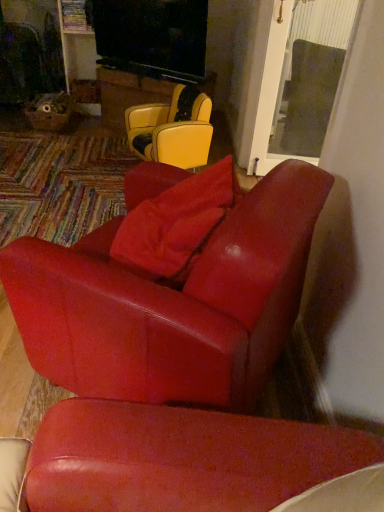
Question: Which direction should I rotate to look at matte red leather chair at center, which is the 2th chair from back to front, — up or down?

Choices:
 (A) up
 (B) down

Answer: (B)

Question: From the image's perspective, is leather yellow chair at center, arranged as the second chair when viewed from the front, beneath matte red leather chair at center, which is the 2th chair from back to front?

Choices:
 (A) no
 (B) yes

Answer: (A)

Question: From a real-world perspective, is leather yellow chair at center, the 2th chair positioned from the bottom, on matte red leather chair at center, which appears as the 1th chair when viewed from the front?

Choices:
 (A) yes
 (B) no

Answer: (B)

Question: Is leather yellow chair at center, which appears as the 1th chair when viewed from the back, directly adjacent to matte red leather chair at center, which appears as the 1th chair when viewed from the front?

Choices:
 (A) yes
 (B) no

Answer: (B)

Question: Considering the relative sizes of leather yellow chair at center, the 2th chair positioned from the bottom, and matte red leather chair at center, which appears as the 1th chair when viewed from the front, in the image provided, is leather yellow chair at center, the 2th chair positioned from the bottom, smaller than matte red leather chair at center, which appears as the 1th chair when viewed from the front,?

Choices:
 (A) yes
 (B) no

Answer: (A)

Question: Does leather yellow chair at center, the first chair positioned from the top, lie behind matte red leather chair at center, which appears as the 1th chair when viewed from the front?

Choices:
 (A) yes
 (B) no

Answer: (A)

Question: Does leather yellow chair at center, which appears as the 1th chair when viewed from the back, have a lesser width compared to matte red leather chair at center, which is the 2th chair from back to front?

Choices:
 (A) no
 (B) yes

Answer: (B)

Question: From a real-world perspective, is transparent glass door at upper right over matte red leather chair at center, which appears as the 1th chair when viewed from the front?

Choices:
 (A) no
 (B) yes

Answer: (A)

Question: Could you tell me if transparent glass door at upper right is facing matte red leather chair at center, acting as the 1th chair starting from the bottom?

Choices:
 (A) yes
 (B) no

Answer: (B)

Question: Is the position of transparent glass door at upper right more distant than that of matte red leather chair at center, which appears as the 1th chair when viewed from the front?

Choices:
 (A) no
 (B) yes

Answer: (B)

Question: From the image's perspective, is transparent glass door at upper right over matte red leather chair at center, which is the 2th chair from back to front?

Choices:
 (A) yes
 (B) no

Answer: (A)

Question: Can you see transparent glass door at upper right touching matte red leather chair at center, which appears as the 1th chair when viewed from the front?

Choices:
 (A) no
 (B) yes

Answer: (A)

Question: Is transparent glass door at upper right facing away from matte red leather chair at center, which ranks as the 2th chair in top-to-bottom order?

Choices:
 (A) yes
 (B) no

Answer: (B)

Question: Can you confirm if leather yellow chair at center, the first chair positioned from the top, is thinner than transparent glass door at upper right?

Choices:
 (A) yes
 (B) no

Answer: (A)